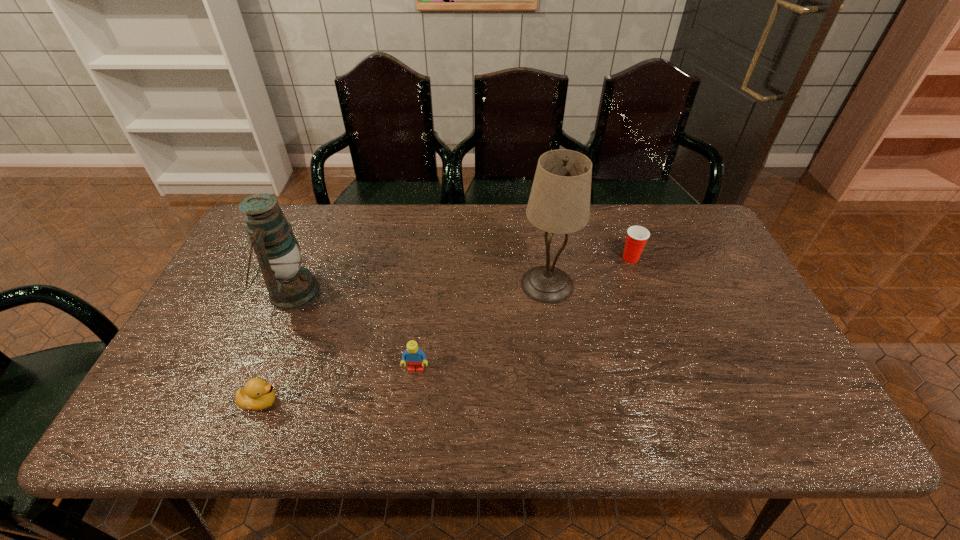
Point out which object is positioned as the nearest to the oil lamp. Please provide its 2D coordinates. Your answer should be formatted as a tuple, i.e. [(x, y)], where the tuple contains the x and y coordinates of a point satisfying the conditions above.

[(256, 395)]

The height and width of the screenshot is (540, 960). What are the coordinates of `object that is the second closest to the rightmost object` in the screenshot? It's located at (415, 358).

Where is `vacant space that satisfies the following two spatial constraints: 1. on the front side of the farthest object; 2. facing forward on the duckling`? The image size is (960, 540). vacant space that satisfies the following two spatial constraints: 1. on the front side of the farthest object; 2. facing forward on the duckling is located at coordinates (682, 402).

Image resolution: width=960 pixels, height=540 pixels. I want to click on vacant space that satisfies the following two spatial constraints: 1. on the front-facing side of the lampshade; 2. facing forward on the shortest object, so click(x=564, y=402).

Where is `vacant point that satisfies the following two spatial constraints: 1. on the face of the third object from left to right; 2. facing forward on the duckling`? Image resolution: width=960 pixels, height=540 pixels. vacant point that satisfies the following two spatial constraints: 1. on the face of the third object from left to right; 2. facing forward on the duckling is located at coordinates (412, 402).

Locate an element on the screen. The width and height of the screenshot is (960, 540). free space that satisfies the following two spatial constraints: 1. on the face of the Lego; 2. facing forward on the nearest object is located at coordinates (412, 402).

You are a GUI agent. You are given a task and a screenshot of the screen. Output one action in this format:
    pyautogui.click(x=<x>, y=<y>)
    Task: Click on the vacant point that satisfies the following two spatial constraints: 1. on the front-facing side of the tallest object; 2. facing forward on the shortest object
    
    Given the screenshot: What is the action you would take?
    pyautogui.click(x=564, y=402)